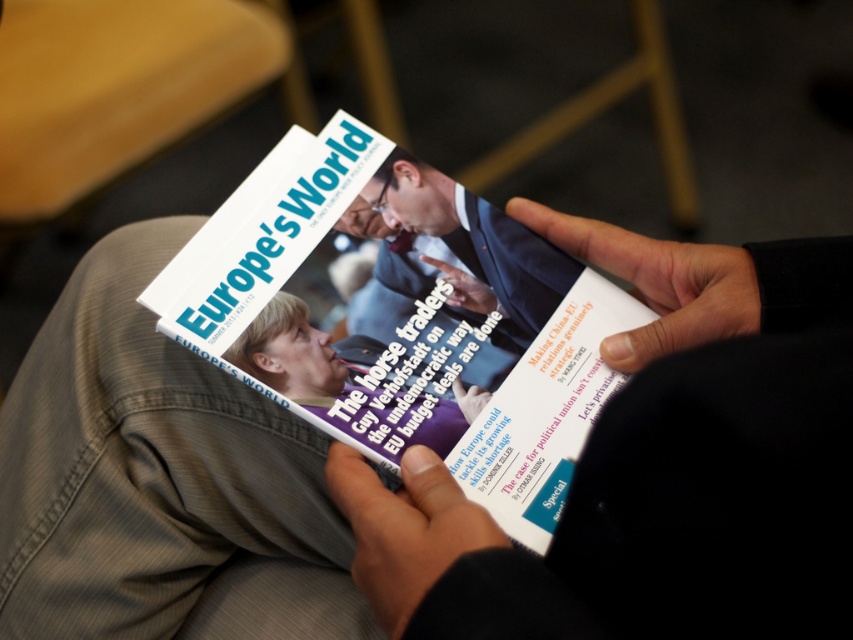
You are a photographer adjusting lighting in a conference room. You notice the smooth black hand at center and the black leather hand at center in your shot. Which hand appears wider in the image?

The smooth black hand at center appears wider than the black leather hand at center because its width surpasses the latter according to the description.

You are a photographer who needs to capture a close shot of the white glossy magazine at center without the black leather hand at center blocking the view. Based on the scene, can you fit the magazine entirely within the frame while avoiding the hand?

The white glossy magazine at center is wider than the black leather hand at center, so it can be positioned in the frame so that the magazine is fully visible without overlapping the hand.